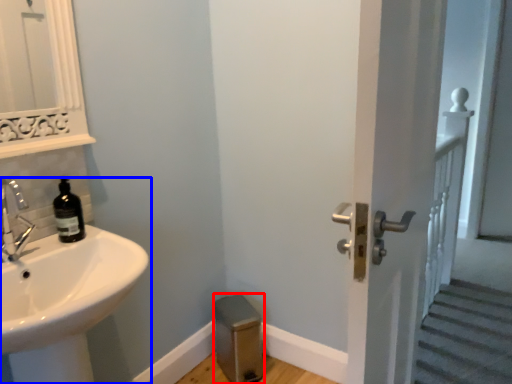
Question: Which object appears farthest to the camera in this image, step stool (highlighted by a red box) or sink (highlighted by a blue box)?

Choices:
 (A) step stool
 (B) sink

Answer: (A)